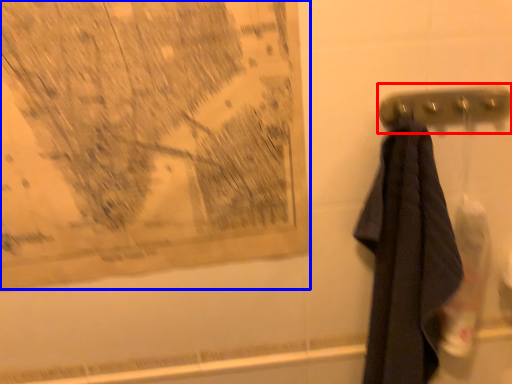
Question: Which point is closer to the camera, towel bar (highlighted by a red box) or map (highlighted by a blue box)?

Choices:
 (A) towel bar
 (B) map

Answer: (B)